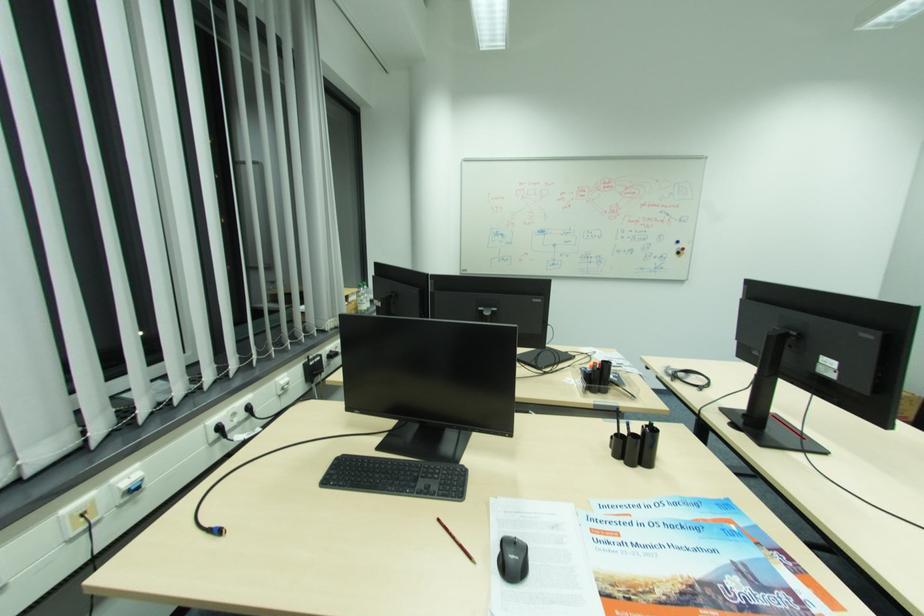
The height and width of the screenshot is (616, 924). Identify the location of black conference microphone. (513, 559).